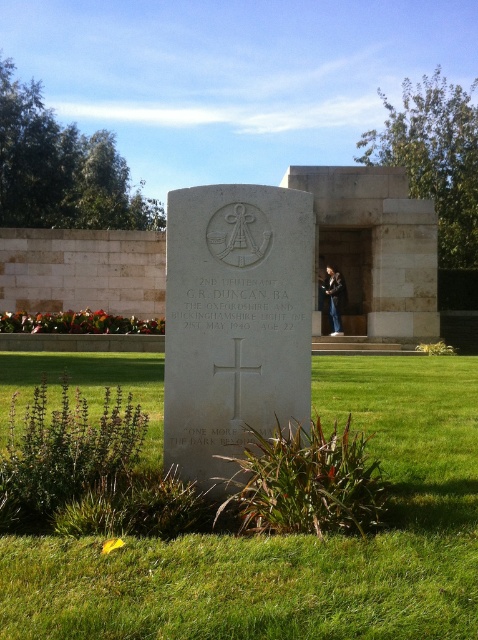
Question: Can you confirm if green grass at center is bigger than black leather jacket at center?

Choices:
 (A) no
 (B) yes

Answer: (B)

Question: Is white stone cross at center above black leather jacket at center?

Choices:
 (A) no
 (B) yes

Answer: (A)

Question: Which object appears farthest from the camera in this image?

Choices:
 (A) black leather jacket at center
 (B) green grass at center
 (C) white stone cross at center

Answer: (A)

Question: Estimate the real-world distances between objects in this image. Which object is closer to the green grass at center?

Choices:
 (A) black leather jacket at center
 (B) white stone cross at center

Answer: (B)

Question: Can you confirm if green grass at center is thinner than white stone cross at center?

Choices:
 (A) no
 (B) yes

Answer: (A)

Question: Estimate the real-world distances between objects in this image. Which object is closer to the white stone cross at center?

Choices:
 (A) black leather jacket at center
 (B) green grass at center

Answer: (B)